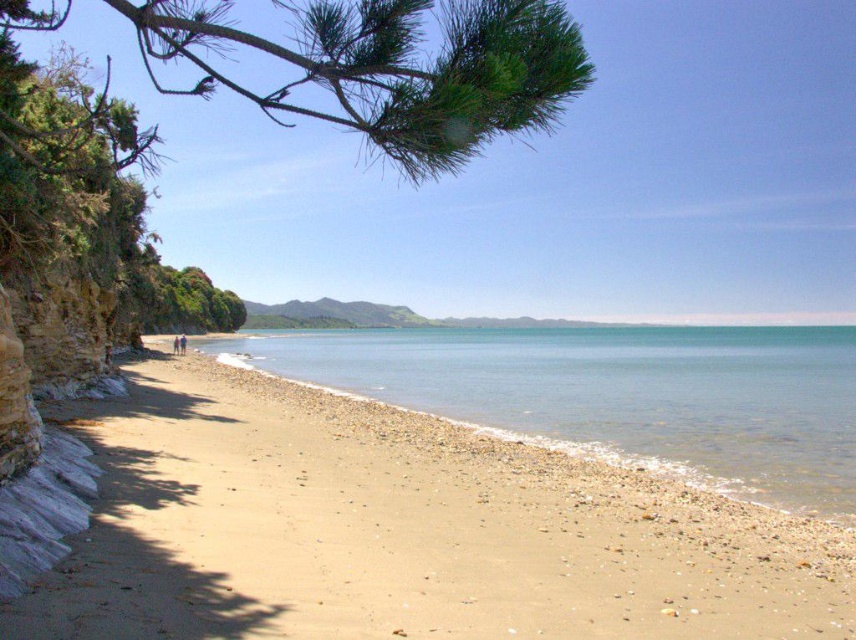
You are standing on the beach and see the clear blue water at center and the blue fabric person at lower left. Which object is closer to the horizon?

The clear blue water at center is closer to the horizon because it is located below the blue fabric person at lower left, placing it further away in the scene.